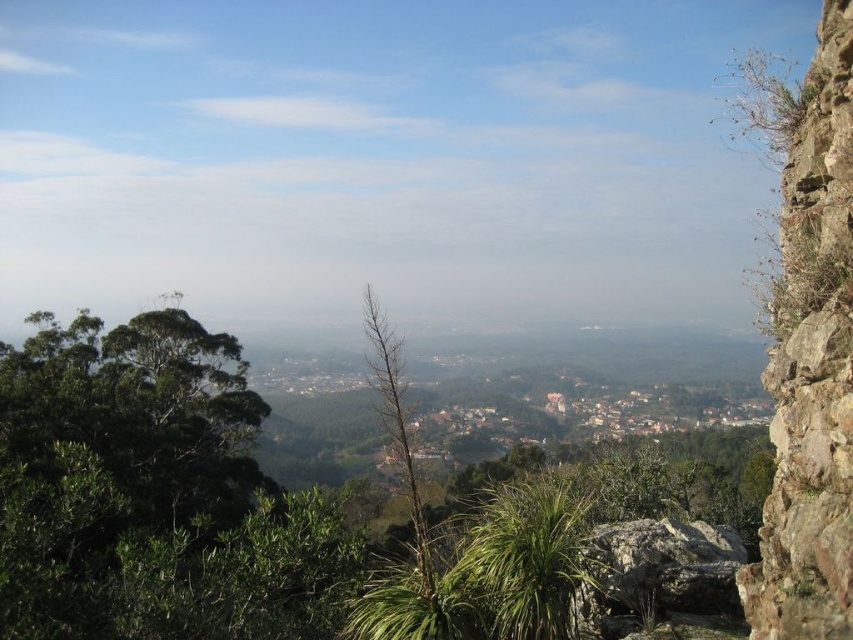
Question: Which point appears farthest from the camera in this image?

Choices:
 (A) (669, 580)
 (B) (833, 132)

Answer: (A)

Question: Is rusty stone cliff at right bigger than rough textured rock at center?

Choices:
 (A) no
 (B) yes

Answer: (B)

Question: Observing the image, what is the correct spatial positioning of rusty stone cliff at right in reference to rough textured rock at center?

Choices:
 (A) right
 (B) left

Answer: (A)

Question: Which point is closer to the camera?

Choices:
 (A) rusty stone cliff at right
 (B) rough textured rock at center

Answer: (A)

Question: Does rusty stone cliff at right have a smaller size compared to rough textured rock at center?

Choices:
 (A) yes
 (B) no

Answer: (B)